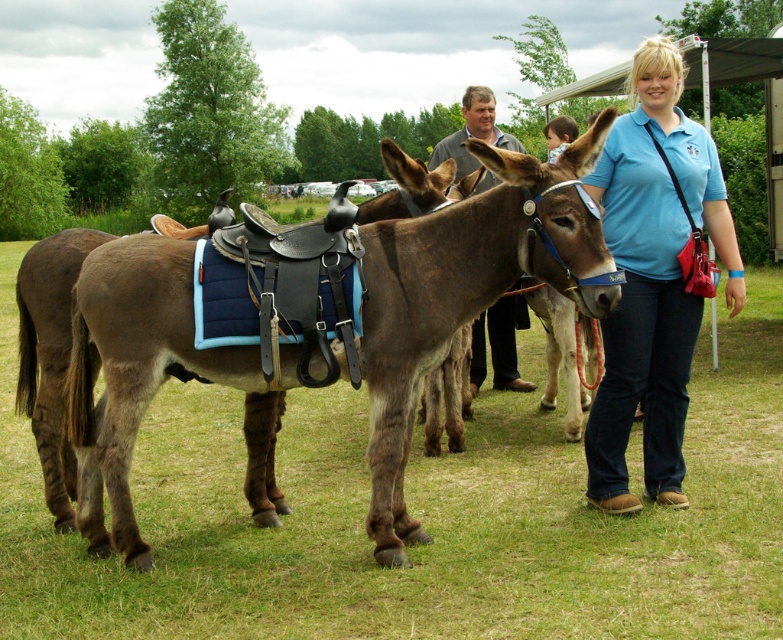
From the picture: Who is positioned more to the left, brown leather saddle at center or blue cotton shirt at center?

From the viewer's perspective, brown leather saddle at center appears more on the left side.

Image resolution: width=783 pixels, height=640 pixels. I want to click on brown leather saddle at center, so click(x=464, y=296).

Does point (316, 355) come in front of point (646, 54)?

Yes, point (316, 355) is in front of point (646, 54).

Find the location of a particular element. brown leather saddle at center is located at coordinates (464, 296).

Does point (601, 204) lie behind point (514, 320)?

No, it is in front of (514, 320).

Image resolution: width=783 pixels, height=640 pixels. Describe the element at coordinates (652, 280) in the screenshot. I see `blue cotton shirt at center` at that location.

The width and height of the screenshot is (783, 640). Describe the element at coordinates (652, 280) in the screenshot. I see `blue cotton shirt at center` at that location.

The image size is (783, 640). Identify the location of blue cotton shirt at center. (652, 280).

Is blue cotton shirt at center thinner than blonde hair at upper right?

Correct, blue cotton shirt at center's width is less than blonde hair at upper right's.

Is blue cotton shirt at center further to the viewer compared to blonde hair at upper right?

No, it is not.

Measure the distance between blue cotton shirt at center and camera.

blue cotton shirt at center is 4.39 meters from camera.

Identify the location of blue cotton shirt at center. (652, 280).